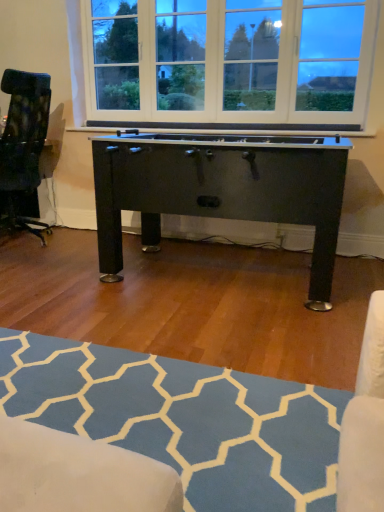
Question: Should I look upward or downward to see blue textured rug at lower center?

Choices:
 (A) down
 (B) up

Answer: (A)